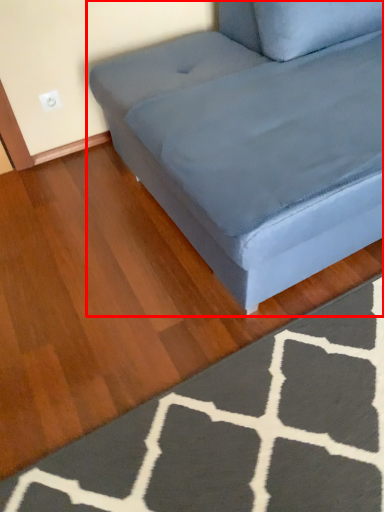
Question: From the image's perspective, what is the correct spatial relationship of studio couch (annotated by the red box) in relation to doormat?

Choices:
 (A) below
 (B) above

Answer: (B)